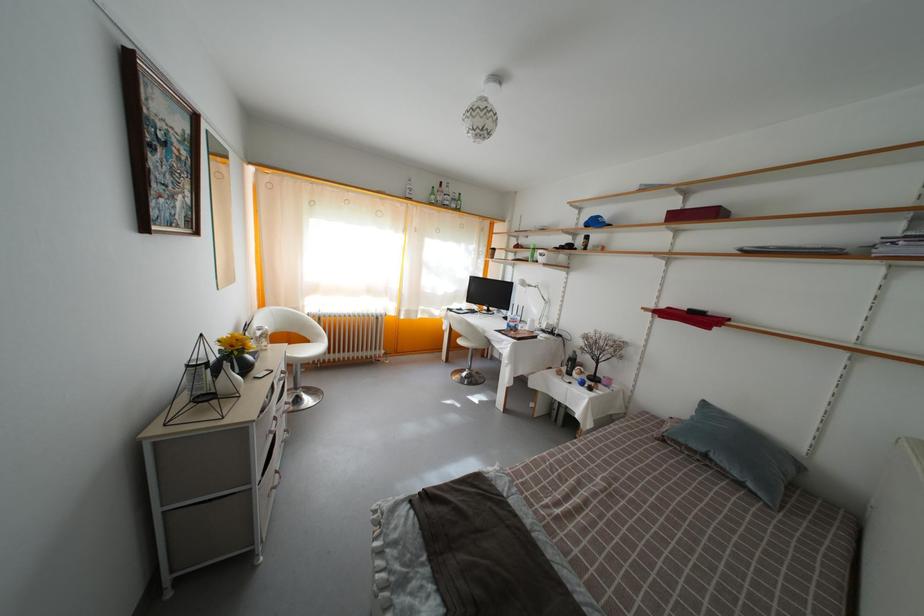
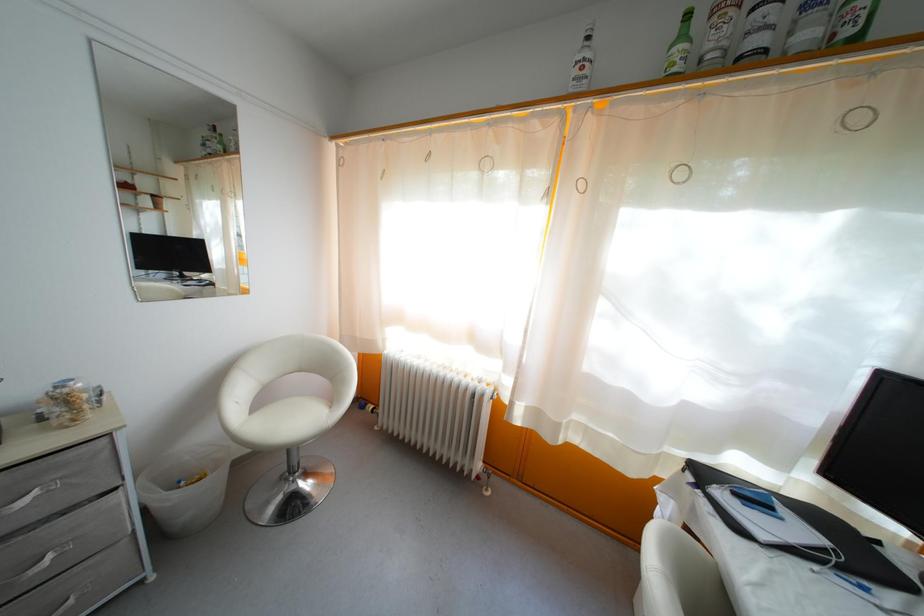
In the second image, find the point that corresponds to pixel 415 198 in the first image.

(581, 79)